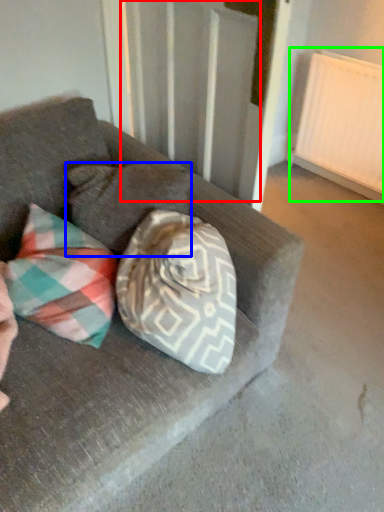
Question: Based on their relative distances, which object is nearer to curtain (highlighted by a red box)? Choose from pillow (highlighted by a blue box) and radiator (highlighted by a green box).

Choices:
 (A) pillow
 (B) radiator

Answer: (A)